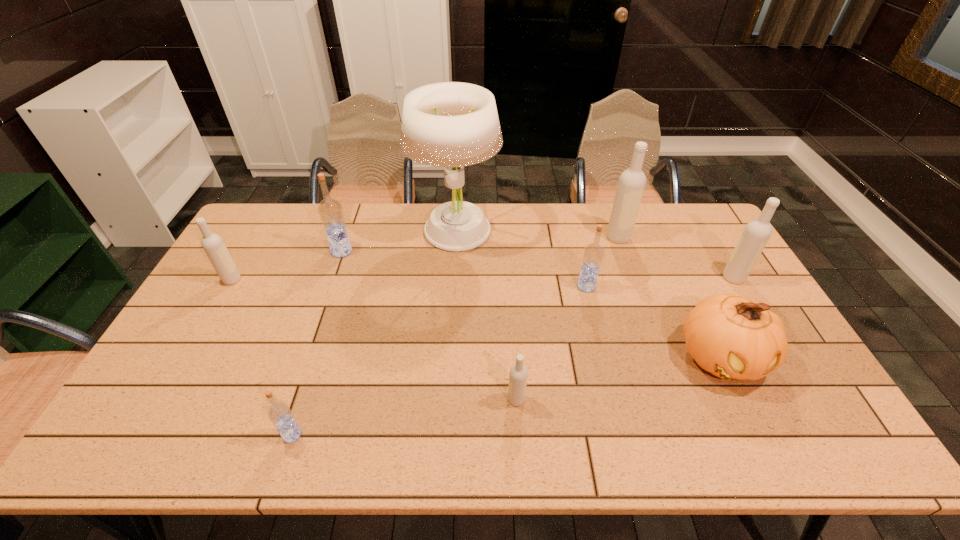
Where is `white lamp`? white lamp is located at coordinates (450, 124).

You are a GUI agent. You are given a task and a screenshot of the screen. Output one action in this format:
    pyautogui.click(x=<x>, y=<y>)
    Task: Click on the lamp
    The width and height of the screenshot is (960, 540).
    Given the screenshot: What is the action you would take?
    (x=450, y=124)

Image resolution: width=960 pixels, height=540 pixels. Identify the location of the third object from right to left. (632, 181).

This screenshot has width=960, height=540. What are the coordinates of `the second white vodka from right to left` in the screenshot? It's located at (632, 181).

The height and width of the screenshot is (540, 960). What are the coordinates of `the biggest blue vodka` in the screenshot? It's located at (330, 210).

Locate an element on the screen. The image size is (960, 540). the rightmost vodka is located at coordinates (757, 232).

This screenshot has height=540, width=960. What are the coordinates of `the rightmost object` in the screenshot? It's located at point(757,232).

Where is `the second nearest blue vodka`? The height and width of the screenshot is (540, 960). the second nearest blue vodka is located at coordinates pyautogui.click(x=593, y=254).

Identify the location of the fourth object from right to left. (593, 254).

Where is `the second smallest white vodka`? the second smallest white vodka is located at coordinates (213, 245).